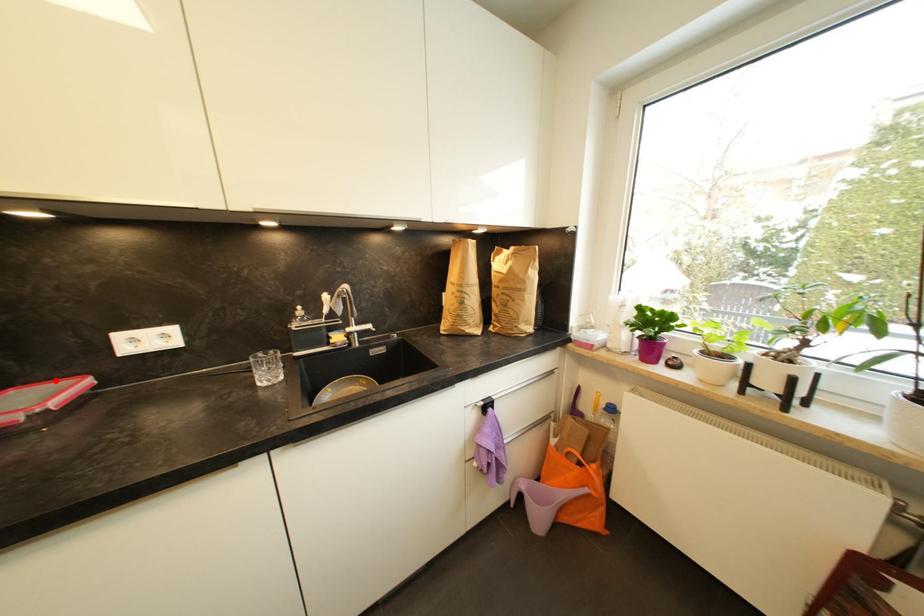
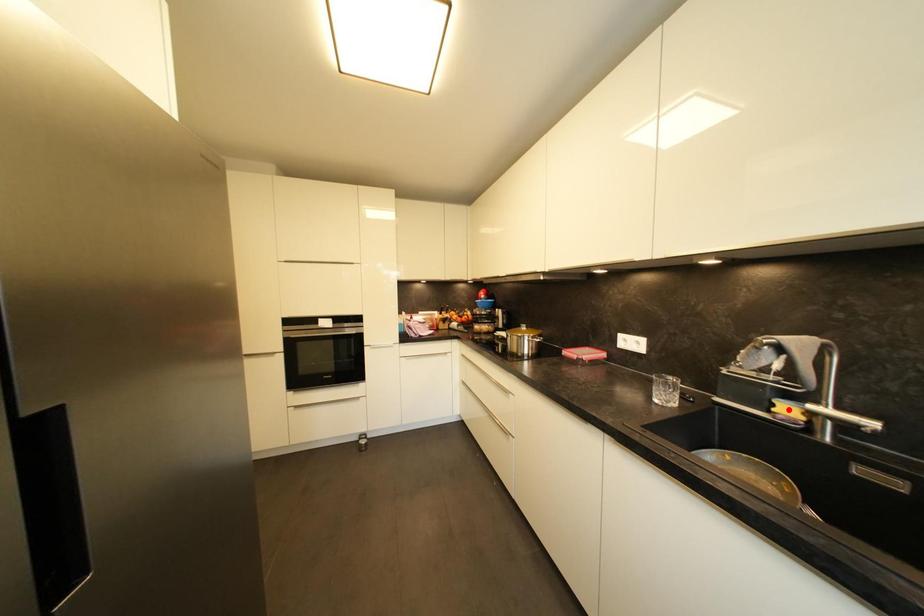
I am providing you with two images of the same scene from different viewpoints. A red point is marked on the first image and another point is marked on the second image. Are the points marked in image1 and image2 representing the same 3D position?

No